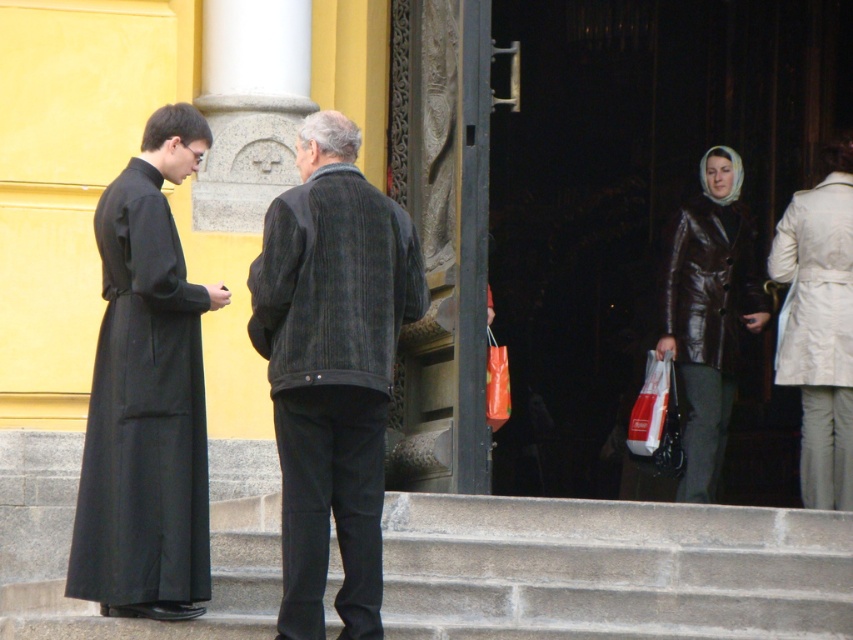
Question: Which point appears farthest from the camera in this image?

Choices:
 (A) (686, 339)
 (B) (149, 230)
 (C) (828, 298)
 (D) (749, 301)

Answer: (D)

Question: In this image, where is matte black robe at left located relative to brown leather jacket at right?

Choices:
 (A) above
 (B) below

Answer: (B)

Question: Which is nearer to the dark corduroy jacket at center?

Choices:
 (A) brown leather coat at right
 (B) dark gray corduroy jacket at center

Answer: (B)

Question: Does dark corduroy jacket at center have a smaller size compared to brown leather coat at right?

Choices:
 (A) no
 (B) yes

Answer: (A)

Question: Can you confirm if brown leather jacket at right is positioned below beige fabric coat at right?

Choices:
 (A) yes
 (B) no

Answer: (B)

Question: Which object appears closest to the camera in this image?

Choices:
 (A) dark corduroy jacket at center
 (B) dark gray corduroy jacket at center
 (C) brown leather coat at right

Answer: (B)